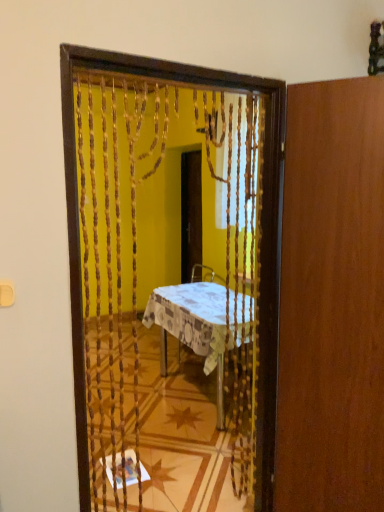
I want to click on patterned fabric table at center, so [x=193, y=326].

What do you see at coordinates (332, 300) in the screenshot?
I see `wooden door at right` at bounding box center [332, 300].

Where is `wooden beaded curtain at center`? The image size is (384, 512). wooden beaded curtain at center is located at coordinates (166, 288).

The width and height of the screenshot is (384, 512). In order to click on patterned fabric table at center in this screenshot , I will do `click(193, 326)`.

At what (x,y) coordinates should I click in order to perform the action: click on mirror above the wooden door at right (from a real-world perspective). Please return your answer as a coordinate pair (x, y). The image size is (384, 512). Looking at the image, I should click on (166, 288).

Is wooden beaded curtain at center at the right side of wooden door at right?

No.

Considering the points (130, 332) and (313, 113), which point is in front, point (130, 332) or point (313, 113)?

The point (313, 113) is in front.

From the image's perspective, which object appears higher, wooden door at right or wooden beaded curtain at center?

wooden beaded curtain at center appears higher in the image.

Is wooden door at right situated inside wooden beaded curtain at center or outside?

The correct answer is: outside.

From a real-world perspective, which is physically below, wooden door at right or wooden beaded curtain at center?

wooden door at right is physically lower.

Is wooden door at right far away from wooden beaded curtain at center?

No, wooden door at right is in close proximity to wooden beaded curtain at center.

Is wooden beaded curtain at center beside patterned fabric table at center?

No, wooden beaded curtain at center is not in contact with patterned fabric table at center.

This screenshot has height=512, width=384. Find the location of `mirror to the left of patterned fabric table at center`. mirror to the left of patterned fabric table at center is located at coordinates (166, 288).

Is wooden beaded curtain at center not within patterned fabric table at center?

Absolutely, wooden beaded curtain at center is external to patterned fabric table at center.

From a real-world perspective, is wooden beaded curtain at center located higher than patterned fabric table at center?

Yes, from a real-world perspective, wooden beaded curtain at center is on top of patterned fabric table at center.

Based on the photo, is patterned fabric table at center touching wooden door at right?

No.

How much distance is there between patterned fabric table at center and wooden door at right?

They are 3.93 feet apart.

From a real-world perspective, is patterned fabric table at center physically above wooden door at right?

No.

What's the angular difference between patterned fabric table at center and wooden door at right's facing directions?

patterned fabric table at center and wooden door at right are facing 32.2 degrees away from each other.

In terms of size, does wooden beaded curtain at center appear bigger or smaller than wooden screen door at center?

Considering their sizes, wooden beaded curtain at center takes up more space than wooden screen door at center.

Is wooden beaded curtain at center not close to wooden screen door at center?

Yes, wooden beaded curtain at center is far from wooden screen door at center.

From the image's perspective, relative to wooden screen door at center, is wooden beaded curtain at center above or below?

Clearly, from the image's perspective, wooden beaded curtain at center is below wooden screen door at center.

Which of these two, wooden screen door at center or patterned fabric table at center, stands taller?

With more height is wooden screen door at center.

Is patterned fabric table at center at the back of wooden screen door at center?

wooden screen door at center is not turned away from patterned fabric table at center.

Which object is positioned more to the left, wooden screen door at center or patterned fabric table at center?

Positioned to the left is wooden screen door at center.

Is wooden door at right bigger than patterned fabric table at center?

Incorrect, wooden door at right is not larger than patterned fabric table at center.

Would you say wooden door at right is to the left or to the right of patterned fabric table at center in the picture?

Clearly, wooden door at right is on the right of patterned fabric table at center in the image.

From the picture: Between wooden door at right and patterned fabric table at center, which one has larger width?

Wider between the two is patterned fabric table at center.

Considering their positions, is wooden door at right located in front of or behind patterned fabric table at center?

Clearly, wooden door at right is in front of patterned fabric table at center.

Where is `door behind the wooden beaded curtain at center`? This screenshot has width=384, height=512. door behind the wooden beaded curtain at center is located at coordinates (332, 300).

This screenshot has width=384, height=512. Identify the location of door that is under the wooden beaded curtain at center (from a real-world perspective). 332,300.

Looking at the image, which one is located closer to wooden screen door at center, wooden door at right or patterned fabric table at center?

patterned fabric table at center is closer to wooden screen door at center.

When comparing their distances from wooden screen door at center, does wooden door at right or wooden beaded curtain at center seem closer?

wooden beaded curtain at center.

Looking at the image, which one is located closer to wooden screen door at center, wooden beaded curtain at center or patterned fabric table at center?

The object closer to wooden screen door at center is patterned fabric table at center.

From the image, which object appears to be nearer to patterned fabric table at center, wooden beaded curtain at center or wooden door at right?

wooden beaded curtain at center is closer to patterned fabric table at center.

Considering their positions, is wooden beaded curtain at center positioned closer to wooden door at right than wooden screen door at center?

Based on the image, wooden beaded curtain at center appears to be nearer to wooden door at right.

Considering their positions, is wooden screen door at center positioned further to patterned fabric table at center than wooden beaded curtain at center?

wooden screen door at center lies further to patterned fabric table at center than the other object.

When comparing their distances from wooden beaded curtain at center, does patterned fabric table at center or wooden screen door at center seem further?

Based on the image, wooden screen door at center appears to be further to wooden beaded curtain at center.

Which object lies nearer to the anchor point wooden beaded curtain at center, wooden door at right or wooden screen door at center?

Based on the image, wooden door at right appears to be nearer to wooden beaded curtain at center.

The height and width of the screenshot is (512, 384). What are the coordinates of `desk between wooden beaded curtain at center and wooden screen door at center in the front-back direction` in the screenshot? It's located at (193, 326).

Find the location of a particular element. door located between wooden beaded curtain at center and patterned fabric table at center in the depth direction is located at coordinates (332, 300).

Find the location of a particular element. The height and width of the screenshot is (512, 384). desk positioned between wooden door at right and wooden screen door at center from near to far is located at coordinates (193, 326).

The height and width of the screenshot is (512, 384). Find the location of `door located between wooden beaded curtain at center and wooden screen door at center in the depth direction`. door located between wooden beaded curtain at center and wooden screen door at center in the depth direction is located at coordinates (332, 300).